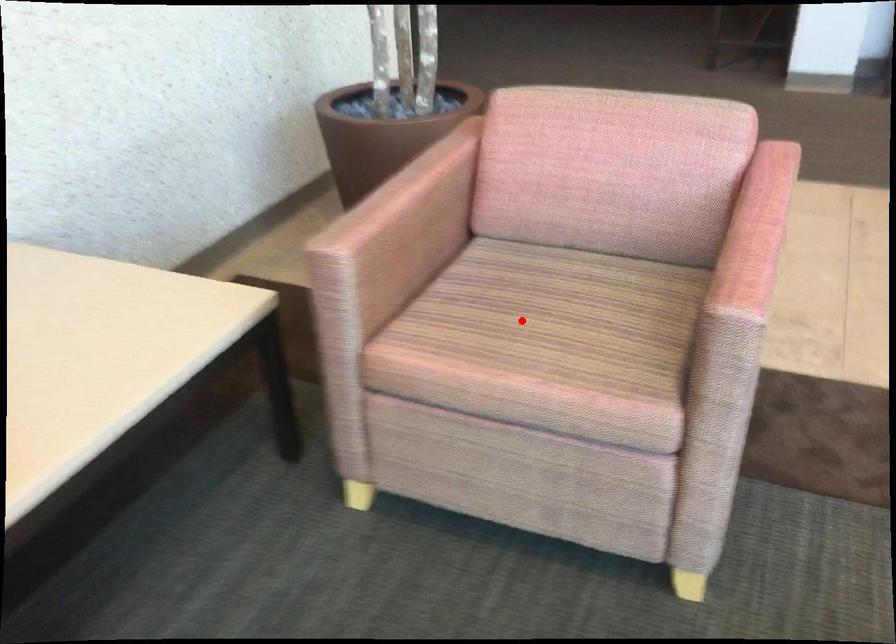
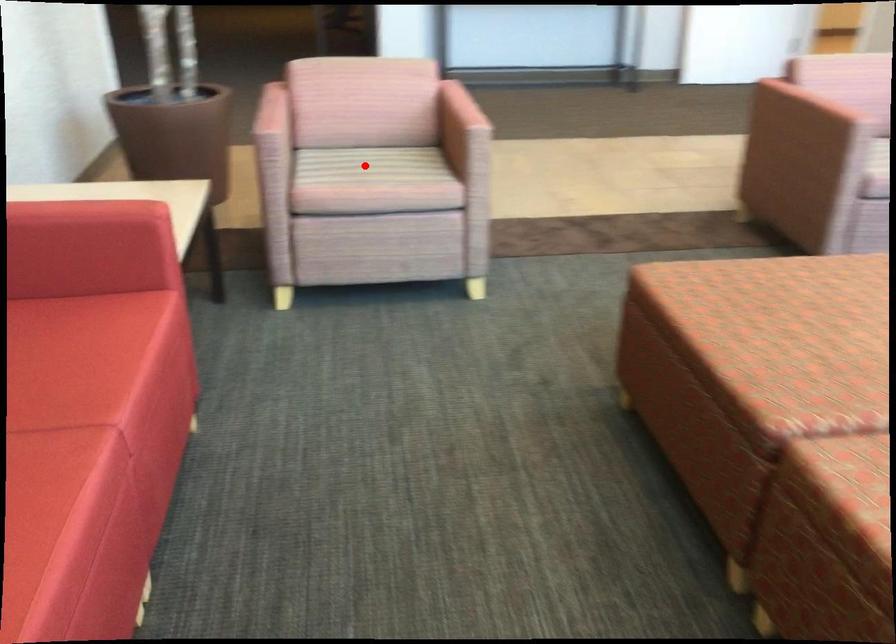
I am providing you with two images of the same scene from different viewpoints. A red point is marked on the first image and another point is marked on the second image. Do the highlighted points in image1 and image2 indicate the same real-world spot?

Yes